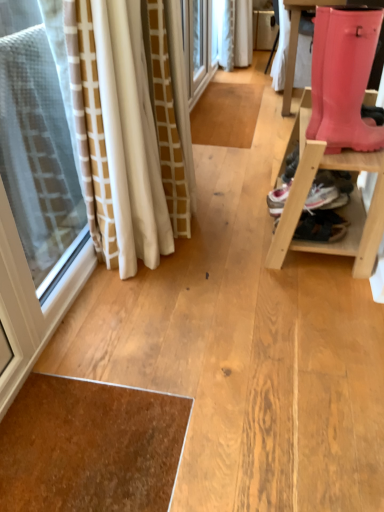
Question: From the image's perspective, is pink rubber boot at right positioned above or below pink rubber boot at right?

Choices:
 (A) above
 (B) below

Answer: (B)

Question: Is pink rubber boot at right taller or shorter than pink rubber boot at right?

Choices:
 (A) short
 (B) tall

Answer: (B)

Question: In the image, is pink rubber boot at right positioned in front of or behind pink rubber boot at right?

Choices:
 (A) behind
 (B) front

Answer: (A)

Question: Is point (317, 113) closer or farther from the camera than point (281, 229)?

Choices:
 (A) closer
 (B) farther

Answer: (A)

Question: Is pink rubber boot at right to the left or to the right of pink rubber boot at right in the image?

Choices:
 (A) left
 (B) right

Answer: (A)

Question: Is pink rubber boot at right inside or outside of pink rubber boot at right?

Choices:
 (A) outside
 (B) inside

Answer: (A)

Question: Is pink rubber boot at right bigger or smaller than pink rubber boot at right?

Choices:
 (A) small
 (B) big

Answer: (A)